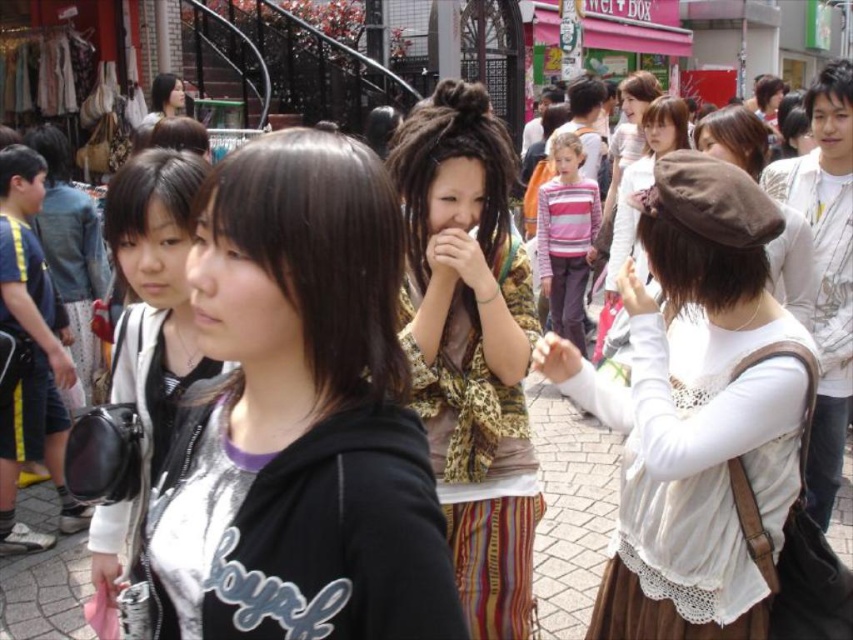
Question: Which point is farther from the camera taking this photo?

Choices:
 (A) (436, 209)
 (B) (387, 573)

Answer: (A)

Question: Can you confirm if white lace blouse at center is wider than leopard print blouse at center?

Choices:
 (A) yes
 (B) no

Answer: (A)

Question: Can you confirm if white lace blouse at center is wider than matte black bag at left?

Choices:
 (A) no
 (B) yes

Answer: (B)

Question: Which object is positioned closest to the white lace blouse at center?

Choices:
 (A) black hoodie at center
 (B) leopard print blouse at center
 (C) matte black bag at left

Answer: (B)

Question: Does black hoodie at center appear over matte black bag at left?

Choices:
 (A) no
 (B) yes

Answer: (A)

Question: Which point is closer to the camera?

Choices:
 (A) (782, 513)
 (B) (252, 538)

Answer: (B)